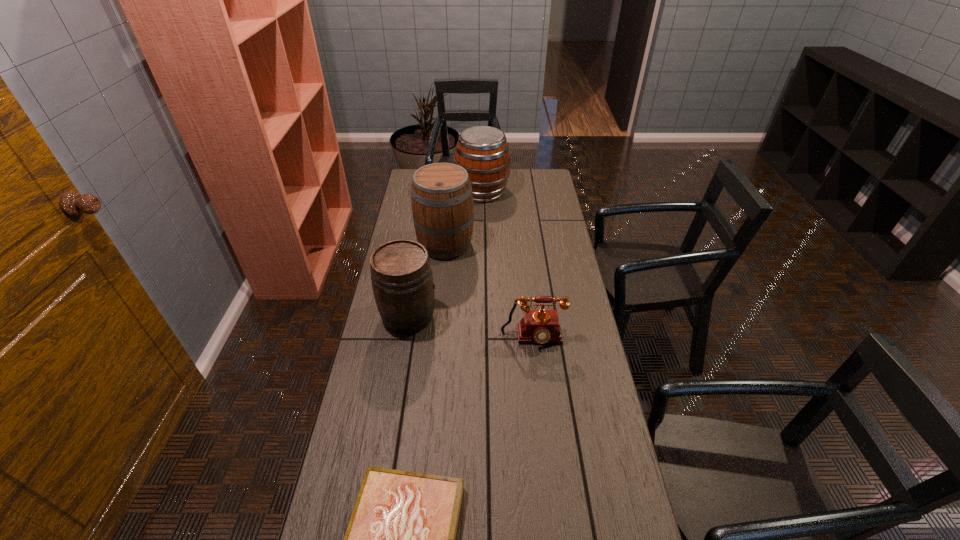
Find the location of `free space that satisfies the following two spatial constraints: 1. on the back side of the second farthest object; 2. on the left side of the farthest object`. free space that satisfies the following two spatial constraints: 1. on the back side of the second farthest object; 2. on the left side of the farthest object is located at coordinates (450, 192).

You are a GUI agent. You are given a task and a screenshot of the screen. Output one action in this format:
    pyautogui.click(x=<x>, y=<y>)
    Task: Click on the vacant point that satisfies the following two spatial constraints: 1. on the front side of the farthest object; 2. on the side of the nearest cider near the bung hole
    The height and width of the screenshot is (540, 960).
    Given the screenshot: What is the action you would take?
    pyautogui.click(x=483, y=316)